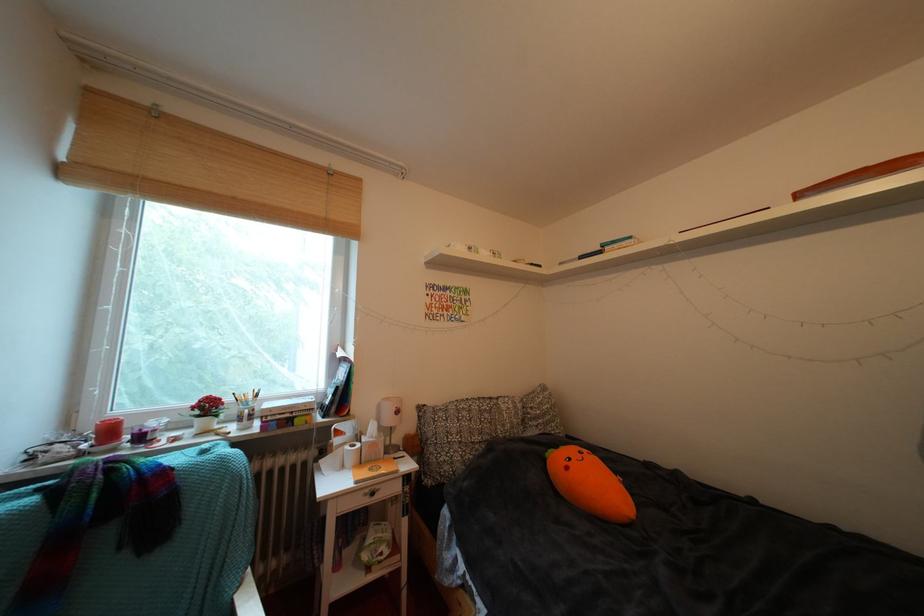
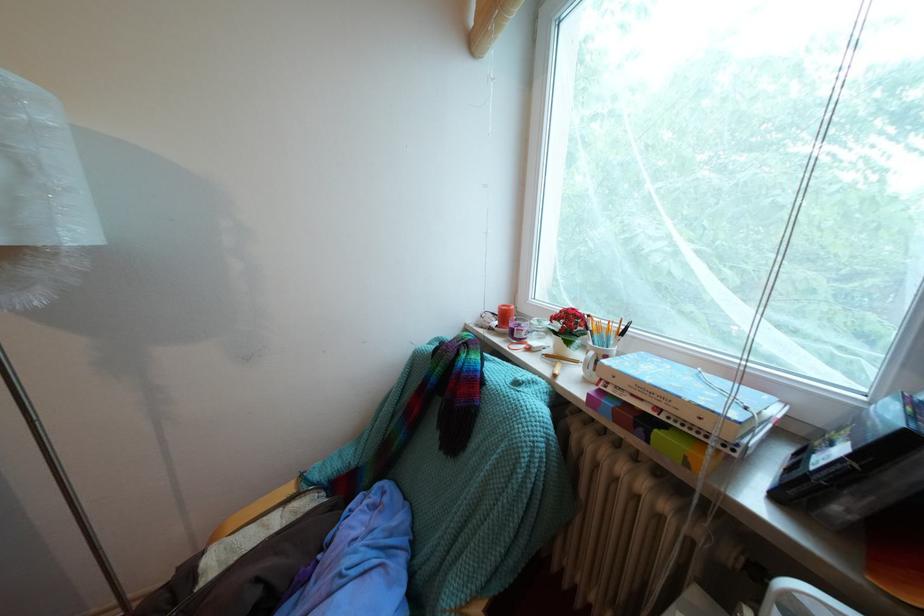
Question: I am providing you with two images of the same scene from different viewpoints. Which of the following objects are not visible in image2?

Choices:
 (A) yellow paintbrush
 (B) white pen holder
 (C) white flower pot
 (D) none of these

Answer: (D)